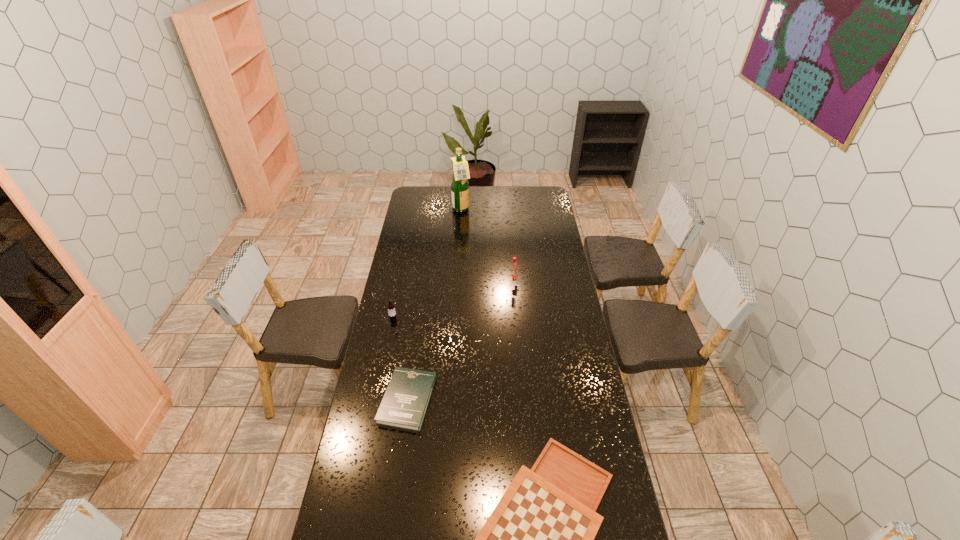
Find the location of a particular element. vacant space that is in between the farther root beer and the left root beer is located at coordinates (453, 301).

At what (x,y) coordinates should I click in order to perform the action: click on vacant point located between the third shortest object and the fourth nearest object. Please return your answer as a coordinate pair (x, y). The width and height of the screenshot is (960, 540). Looking at the image, I should click on (453, 301).

Select which object appears as the second closest to the book. Please provide its 2D coordinates. Your answer should be formatted as a tuple, i.e. [(x, y)], where the tuple contains the x and y coordinates of a point satisfying the conditions above.

[(391, 307)]

Locate an element on the screen. This screenshot has width=960, height=540. object that can be found as the second closest to the second nearest object is located at coordinates [x=391, y=307].

Locate an element on the screen. The height and width of the screenshot is (540, 960). blank space that satisfies the following two spatial constraints: 1. on the back side of the farther root beer; 2. on the front-facing side of the tallest object is located at coordinates tap(507, 210).

Find the location of a particular element. vacant space that satisfies the following two spatial constraints: 1. on the back side of the second tallest object; 2. on the front-facing side of the third object from right to left is located at coordinates (507, 210).

Identify the location of vacant space that satisfies the following two spatial constraints: 1. on the front-facing side of the fourth nearest object; 2. on the right side of the liquor. (457, 282).